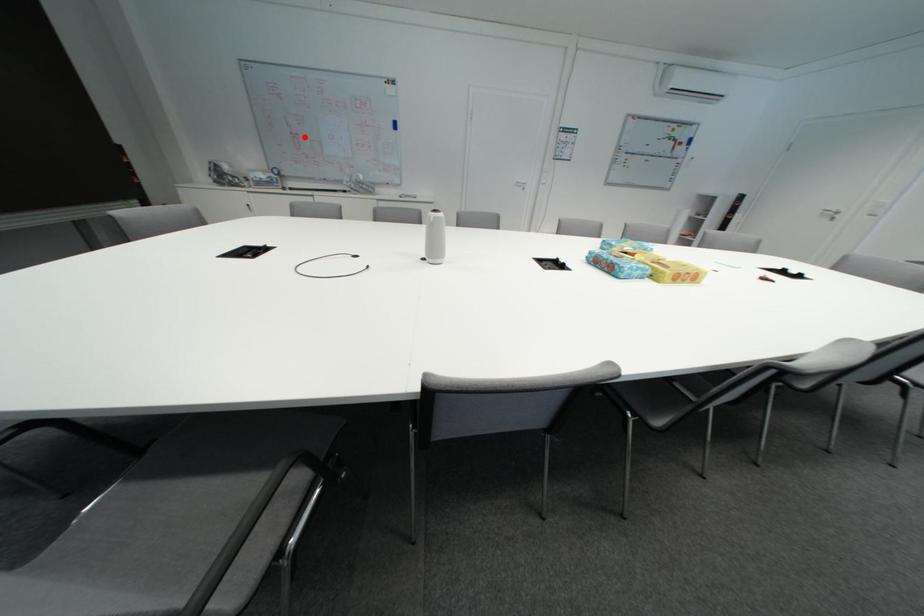
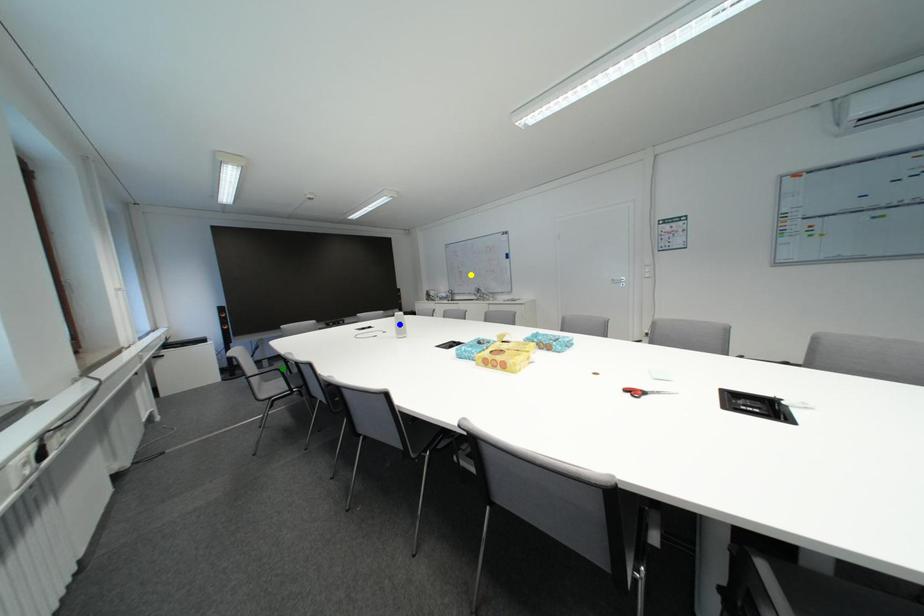
Question: I am providing you with two images of the same scene from different viewpoints. A red point is marked on the first image. You are given multiple points on the second image. In image 2, which mark is for the same physical point as the one in image 1?

Choices:
 (A) yellow point
 (B) green point
 (C) blue point

Answer: (A)